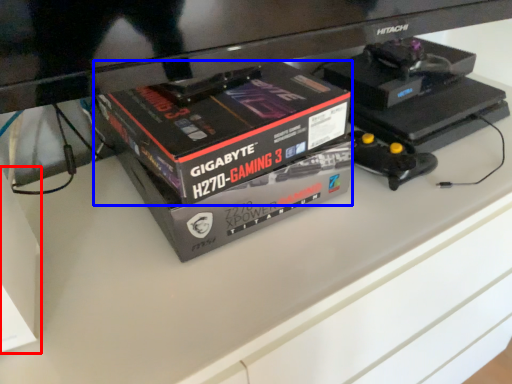
Question: Which point is further to the camera, box (highlighted by a red box) or box (highlighted by a blue box)?

Choices:
 (A) box
 (B) box

Answer: (B)